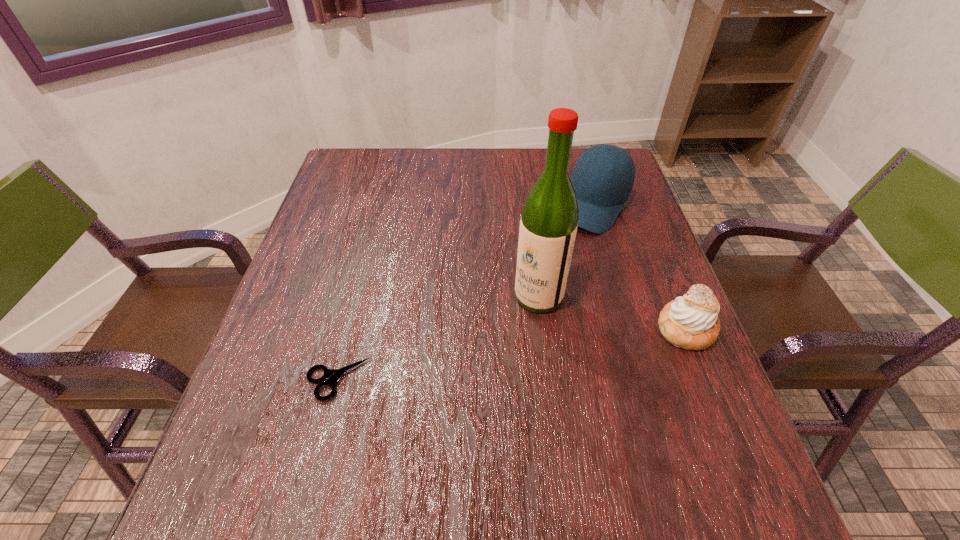
Where is `vacant space at the far edge of the desktop`? This screenshot has height=540, width=960. vacant space at the far edge of the desktop is located at coordinates (507, 184).

In the image, there is a desktop. Where is `vacant space at the near edge`? The height and width of the screenshot is (540, 960). vacant space at the near edge is located at coordinates (519, 458).

Find the location of a particular element. blank space at the left edge of the desktop is located at coordinates (323, 230).

The width and height of the screenshot is (960, 540). I want to click on blank space at the right edge, so click(x=646, y=305).

You are a GUI agent. You are given a task and a screenshot of the screen. Output one action in this format:
    pyautogui.click(x=<x>, y=<y>)
    Task: Click on the vacant space at the far left corner
    This screenshot has width=960, height=540.
    Given the screenshot: What is the action you would take?
    pyautogui.click(x=359, y=149)

The height and width of the screenshot is (540, 960). Identify the location of vacant region between the second shortest object and the second tallest object. click(639, 267).

Image resolution: width=960 pixels, height=540 pixels. I want to click on free space between the leftmost object and the pastry, so click(x=512, y=354).

At what (x,y) coordinates should I click in order to perform the action: click on vacant space that is in between the second shortest object and the baseball cap. Please return your answer as a coordinate pair (x, y). This screenshot has width=960, height=540. Looking at the image, I should click on (639, 267).

Locate an element on the screen. Image resolution: width=960 pixels, height=540 pixels. unoccupied area between the second shortest object and the tallest object is located at coordinates (612, 313).

Where is `free space between the tallest object and the leftmost object`? This screenshot has width=960, height=540. free space between the tallest object and the leftmost object is located at coordinates (438, 338).